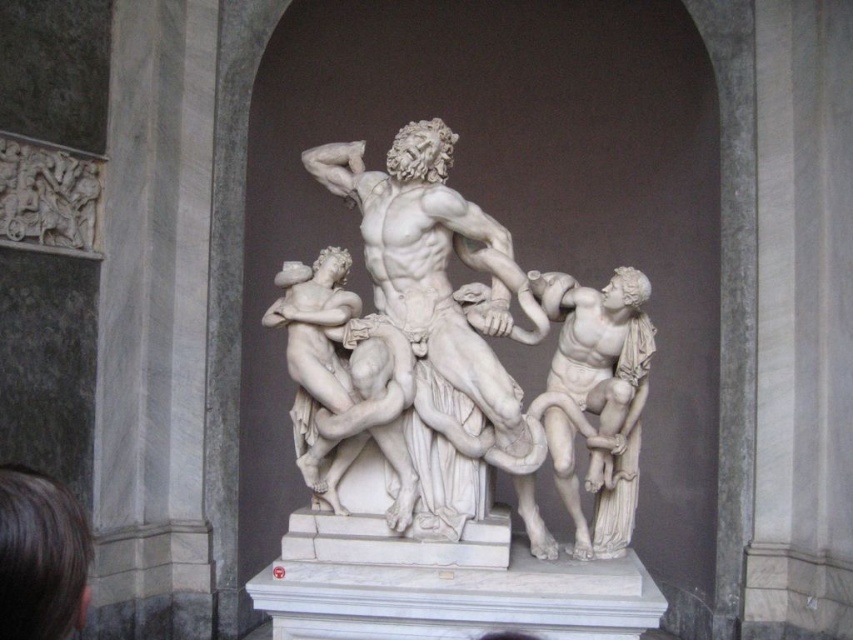
Measure the distance from white marble sculpture at center to white marble statue at right.

A distance of 14.59 inches exists between white marble sculpture at center and white marble statue at right.

Can you confirm if white marble sculpture at center is bigger than white marble statue at right?

Correct, white marble sculpture at center is larger in size than white marble statue at right.

Does point (347, 252) come closer to viewer compared to point (635, 432)?

No, it is behind (635, 432).

Find the location of a particular element. white marble sculpture at center is located at coordinates (457, 353).